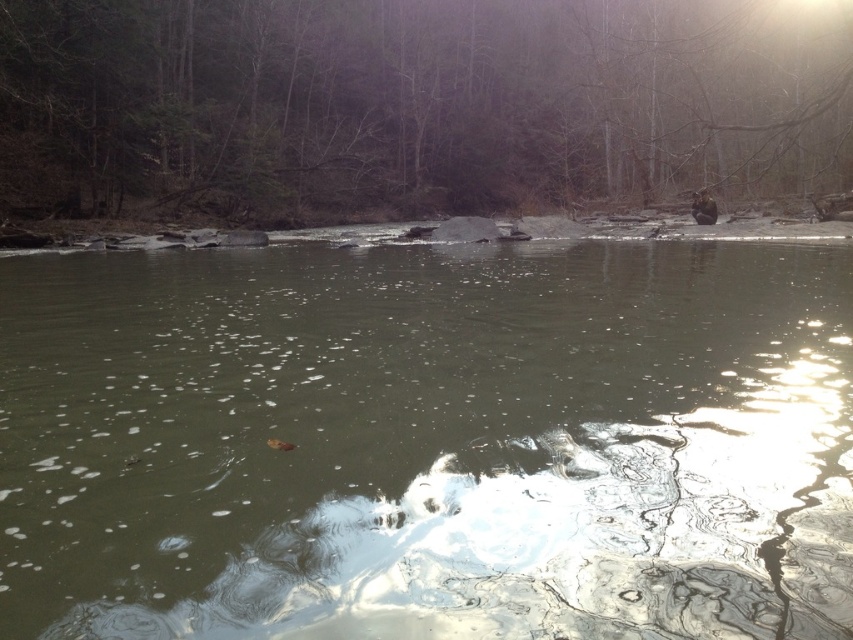
You are standing at the camera position and want to reach the point marked at coordinates (492, 330) in the image. If your walking speed is 3 feet per second, how many seconds will it take you to reach that point?

The point marked at coordinates (492, 330) is 34.04 feet away from the camera. At a walking speed of 3 feet per second, it would take approximately 11.35 seconds to reach that point.

You are standing at the edge of the water in the forest scene. You see two points marked in the image. Which point, point (759, 474) or point (39, 209), is closer to you?

Point (759, 474) is closer to you than point (39, 209).

Please provide the 2D coordinates of the greenish murky water at center in the image. The coordinates should be in the format of a tuple with two decimal numbers, like this example format. Please do not add any extra information or explanation.

The 2D coordinates of the greenish murky water at center are at point [427,442].